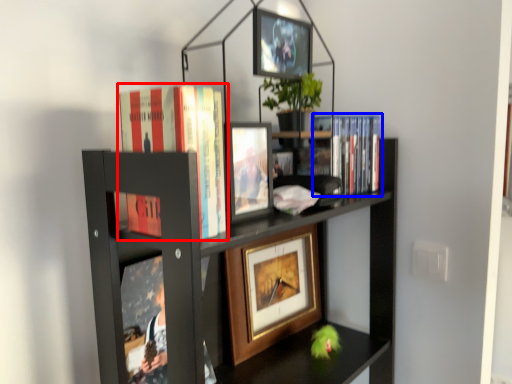
Question: Which point is closer to the camera, book (highlighted by a red box) or book (highlighted by a blue box)?

Choices:
 (A) book
 (B) book

Answer: (A)